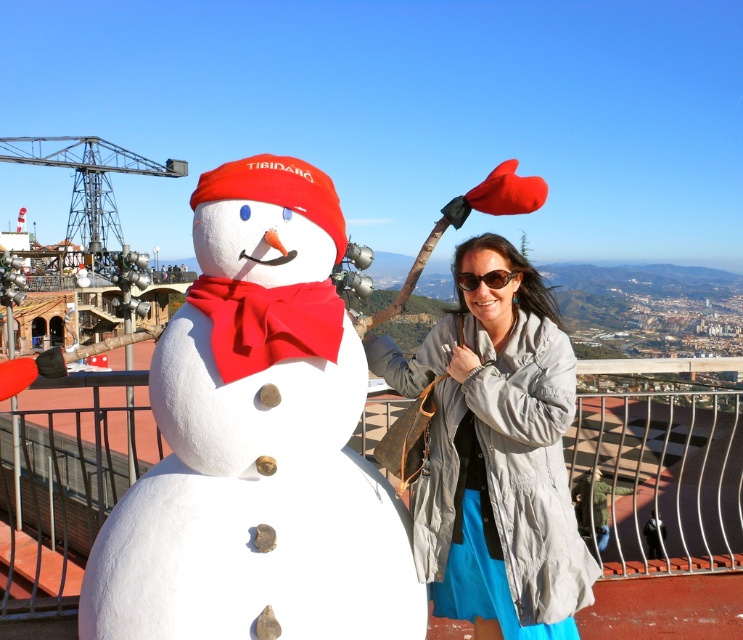
Measure the distance between point (455, 577) and camera.

Point (455, 577) is 33.91 meters from camera.

Does point (377, 352) lie behind point (506, 273)?

Yes.

You are a GUI agent. You are given a task and a screenshot of the screen. Output one action in this format:
    pyautogui.click(x=<x>, y=<y>)
    Task: Click on the matte gray jacket at center
    Image resolution: width=743 pixels, height=640 pixels.
    Given the screenshot: What is the action you would take?
    pyautogui.click(x=496, y=454)

Which is more to the right, white matte snowman at center or sunglasses at center?

sunglasses at center is more to the right.

At what (x,y) coordinates should I click in order to perform the action: click on white matte snowman at center. Please return your answer as a coordinate pair (x, y). This screenshot has width=743, height=640. Looking at the image, I should click on (256, 442).

You are a GUI agent. You are given a task and a screenshot of the screen. Output one action in this format:
    pyautogui.click(x=<x>, y=<y>)
    Task: Click on the white matte snowman at center
    The width and height of the screenshot is (743, 640).
    Given the screenshot: What is the action you would take?
    pyautogui.click(x=256, y=442)

Does white matte snowman at center have a lesser width compared to matte gray jacket at center?

Yes, white matte snowman at center is thinner than matte gray jacket at center.

Between white matte snowman at center and matte gray jacket at center, which one is positioned lower?

Positioned lower is matte gray jacket at center.

What do you see at coordinates (256, 442) in the screenshot? Image resolution: width=743 pixels, height=640 pixels. I see `white matte snowman at center` at bounding box center [256, 442].

Where is `white matte snowman at center`? white matte snowman at center is located at coordinates click(x=256, y=442).